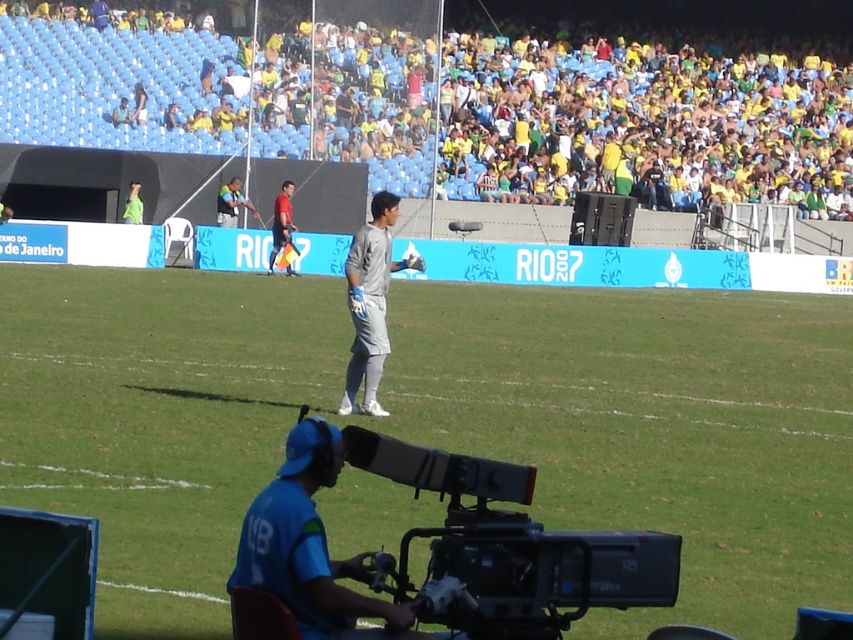
Question: Does yellow/yellow-green fabric seats at upper center have a lesser width compared to green jersey at upper left?

Choices:
 (A) no
 (B) yes

Answer: (A)

Question: Which point is farther from the camera taking this photo?

Choices:
 (A) (358, 141)
 (B) (321, 609)

Answer: (A)

Question: Does yellow/yellow-green fabric seats at upper center appear on the left side of red shirt at center?

Choices:
 (A) no
 (B) yes

Answer: (A)

Question: Can you confirm if green grass at center is thinner than gray matte uniform at center?

Choices:
 (A) yes
 (B) no

Answer: (B)

Question: Estimate the real-world distances between objects in this image. Which object is closer to the red shirt at center?

Choices:
 (A) gray matte uniform at center
 (B) black plastic television camera at center
 (C) blue fabric cap at lower center

Answer: (A)

Question: Which point is closer to the camera?

Choices:
 (A) green jersey at upper left
 (B) green grass at center
 (C) yellow/yellow-green fabric seats at upper center

Answer: (B)